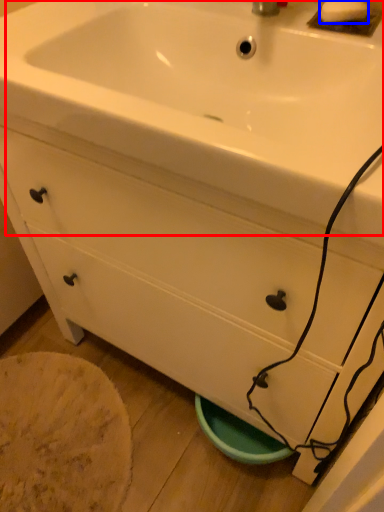
Question: Which object appears farthest to the camera in this image, sink (highlighted by a red box) or soap (highlighted by a blue box)?

Choices:
 (A) sink
 (B) soap

Answer: (B)